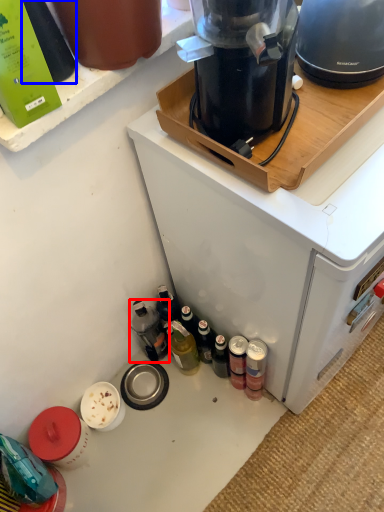
Question: Among these objects, which one is farthest to the camera, bottle (highlighted by a red box) or bottle (highlighted by a blue box)?

Choices:
 (A) bottle
 (B) bottle

Answer: (A)